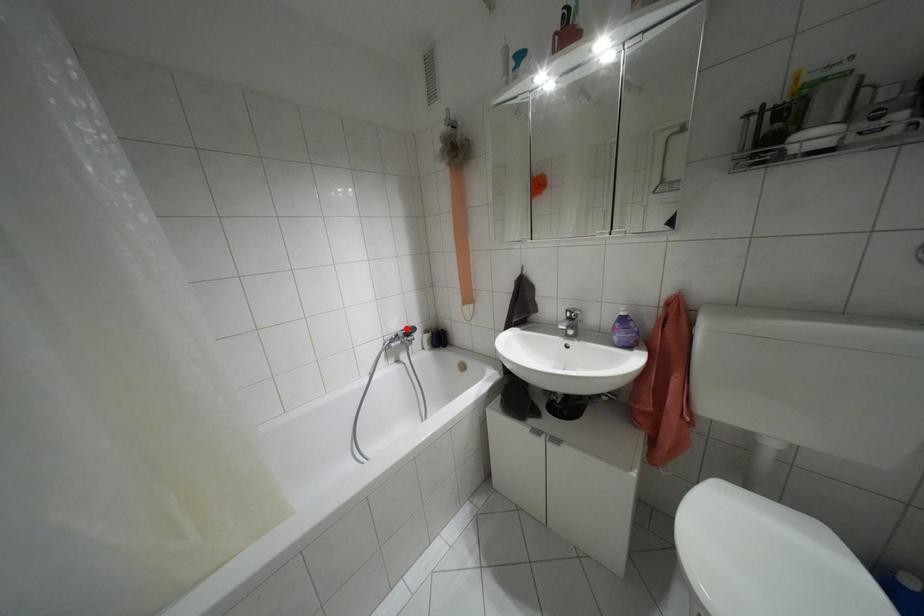
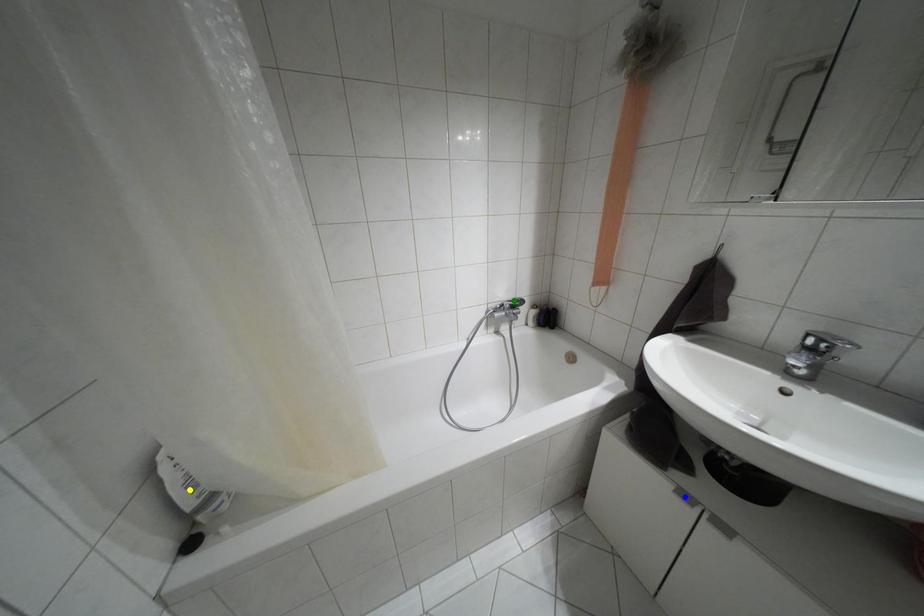
Question: I am providing you with two images of the same scene from different viewpoints. A red point is marked on the first image. You are given multiple points on the second image. Which spot in image 2 lines up with the point in image 1?

Choices:
 (A) yellow point
 (B) blue point
 (C) green point

Answer: (C)